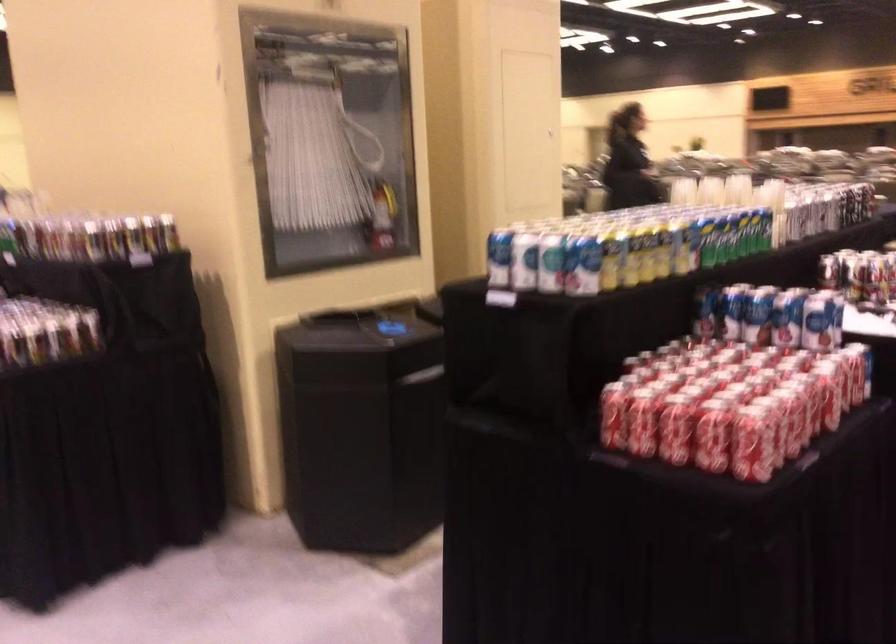
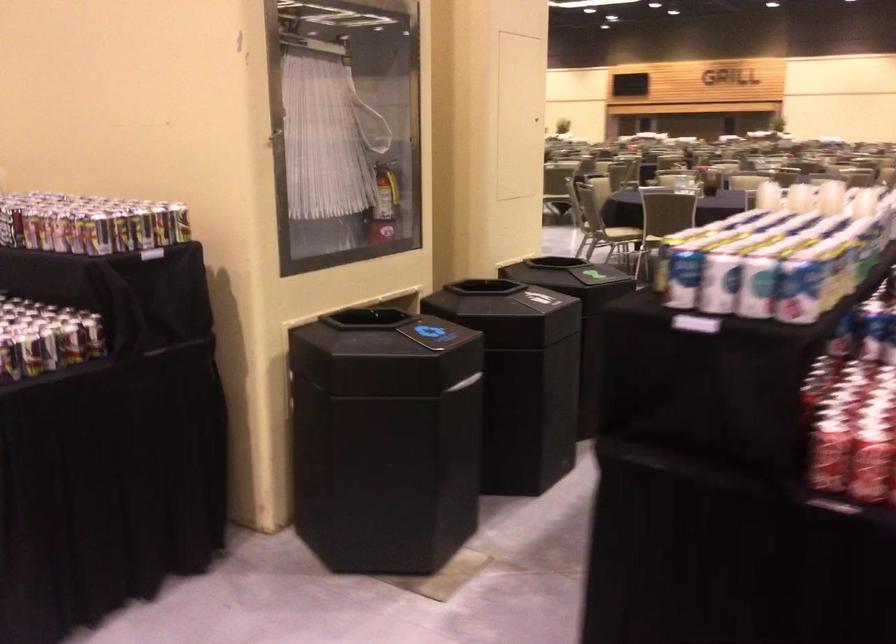
From the picture: Which direction would the cameraman need to move to produce the second image?

The movement direction of the cameraman is left, forward.